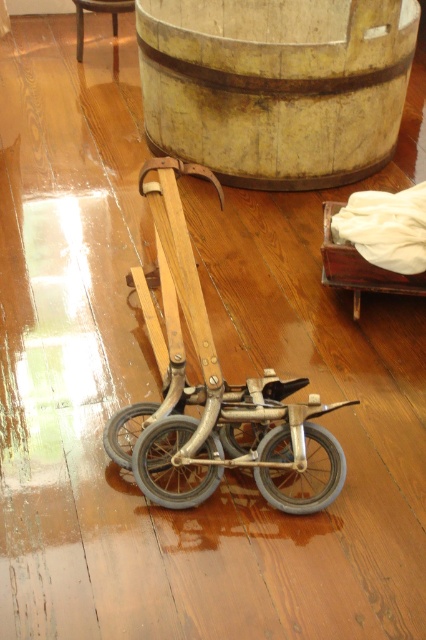
What do you see at coordinates (305, 476) in the screenshot?
I see `metallic gray wheel at center` at bounding box center [305, 476].

Which is above, metallic gray wheel at center or gray rubber wheel at center?

gray rubber wheel at center

The height and width of the screenshot is (640, 426). Identify the location of metallic gray wheel at center. (305, 476).

At what (x,y) coordinates should I click in order to perform the action: click on metallic gray wheel at center. Please return your answer as a coordinate pair (x, y). Looking at the image, I should click on (305, 476).

Does wooden barrel at upper center have a greater width compared to gray rubber wheel at center?

Yes.

Is wooden barrel at upper center taller than gray rubber wheel at center?

Indeed, wooden barrel at upper center has a greater height compared to gray rubber wheel at center.

Where is `wooden barrel at upper center`? Image resolution: width=426 pixels, height=640 pixels. wooden barrel at upper center is located at coordinates (276, 84).

The image size is (426, 640). Find the location of `wooden barrel at upper center`. wooden barrel at upper center is located at coordinates (276, 84).

In the scene shown: Which of these two, metallic gray wheel at center or metallic silver wheel at lower center, stands shorter?

metallic silver wheel at lower center

Does metallic gray wheel at center appear on the left side of metallic silver wheel at lower center?

No, metallic gray wheel at center is not to the left of metallic silver wheel at lower center.

Is point (307, 493) farther from viewer compared to point (141, 428)?

No, it is in front of (141, 428).

Identify the location of metallic gray wheel at center. The height and width of the screenshot is (640, 426). (305, 476).